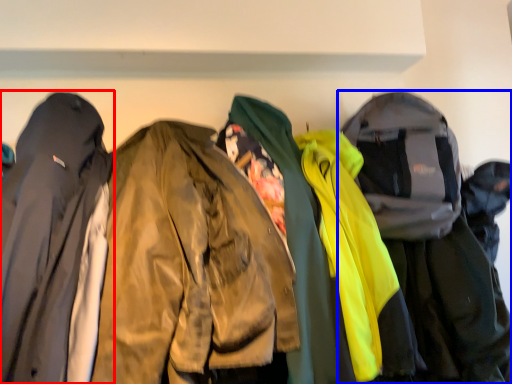
Question: Which point is closer to the camera, jacket (highlighted by a red box) or jacket (highlighted by a blue box)?

Choices:
 (A) jacket
 (B) jacket

Answer: (A)